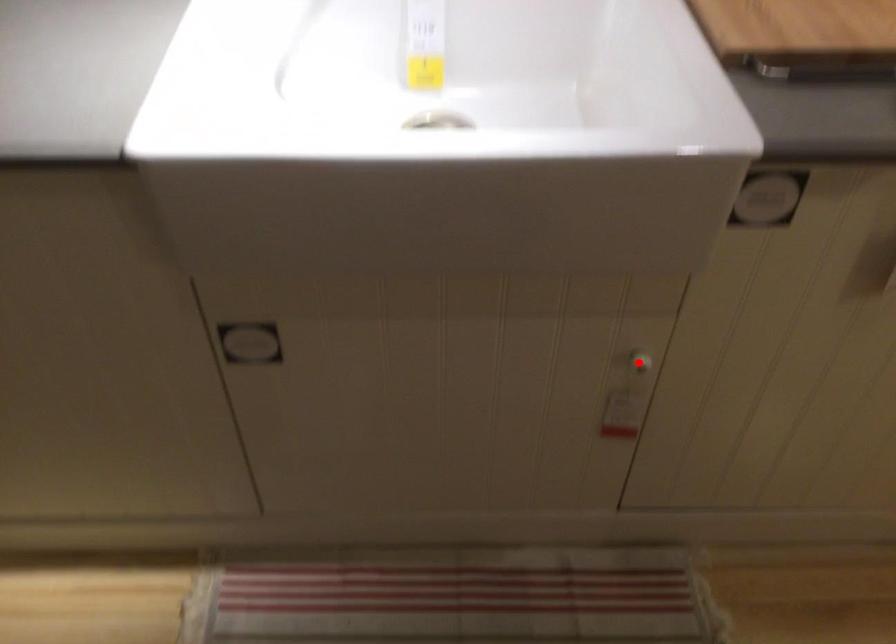
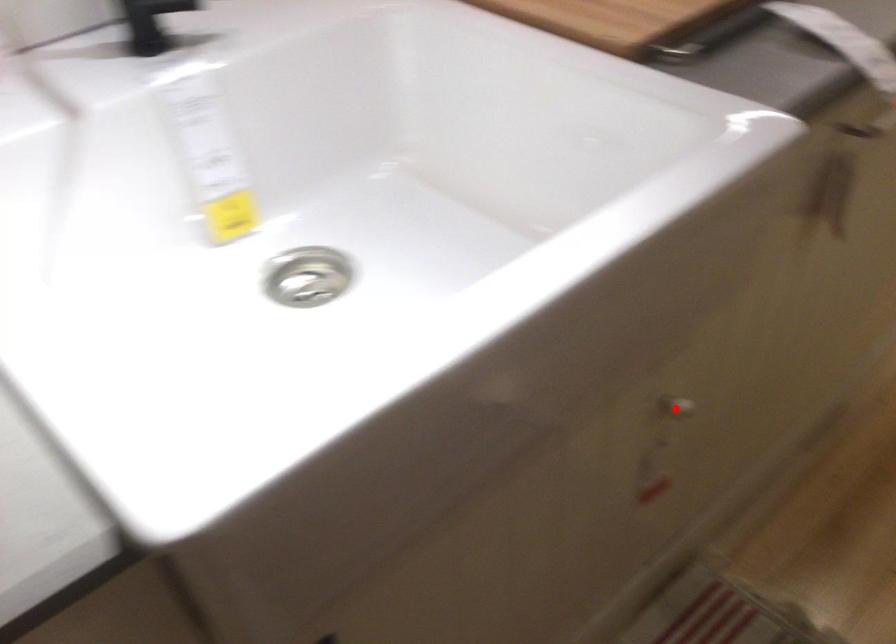
I am providing you with two images of the same scene from different viewpoints. A red point is marked on the first image and another point is marked on the second image. Are the points marked in image1 and image2 representing the same 3D position?

Yes